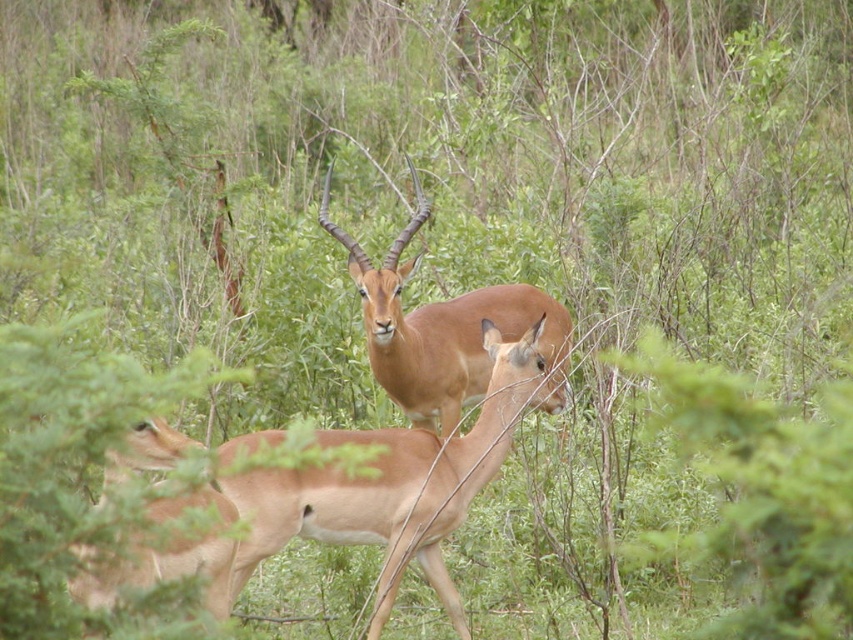
You are an animal tracker analyzing the image. You need to locate the light brown fur at center in the image. What are its coordinates?

The light brown fur at center is located at coordinates point (x=395, y=484).